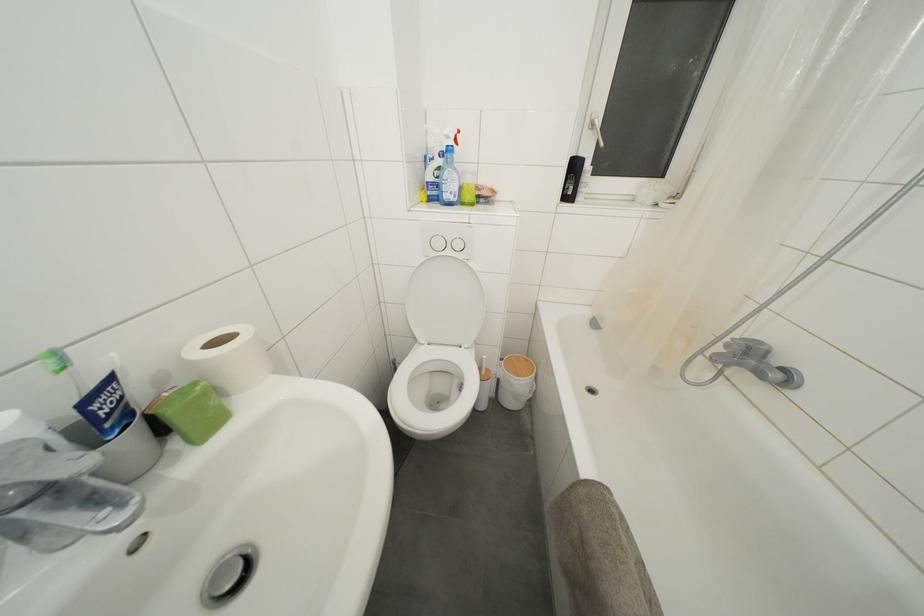
Where is `shower diverter knob`? The width and height of the screenshot is (924, 616). shower diverter knob is located at coordinates tap(228, 576).